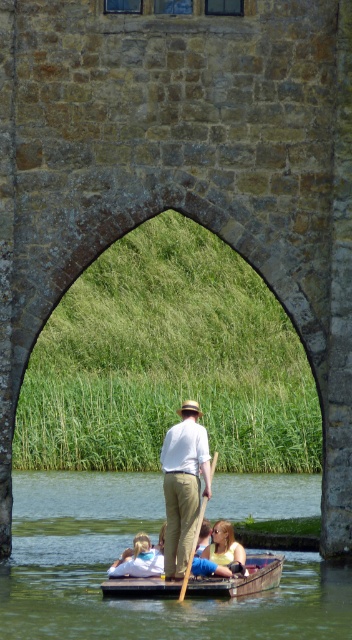
Question: Estimate the real-world distances between objects in this image. Which object is closer to the khaki cotton pants at center?

Choices:
 (A) blonde hair at center
 (B) light brown hair at center

Answer: (A)

Question: Is green smooth water at center bigger than wooden canoe at center?

Choices:
 (A) yes
 (B) no

Answer: (A)

Question: Can you confirm if khaki cotton pants at center is positioned to the right of blonde hair at center?

Choices:
 (A) yes
 (B) no

Answer: (B)

Question: Can you confirm if wooden canoe at center is positioned below light brown hair at center?

Choices:
 (A) yes
 (B) no

Answer: (B)

Question: Which of the following is the closest to the observer?

Choices:
 (A) khaki cotton pants at center
 (B) blonde hair at center
 (C) green smooth water at center

Answer: (C)

Question: Which point is closer to the camera?

Choices:
 (A) green smooth water at center
 (B) blonde hair at center
 (C) khaki cotton pants at center
 (D) light brown hair at center

Answer: (A)